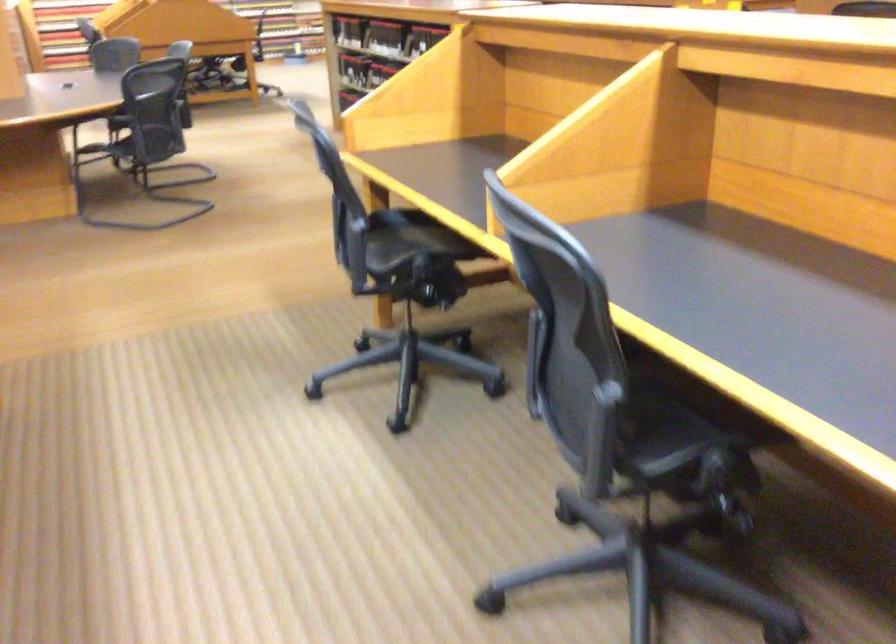
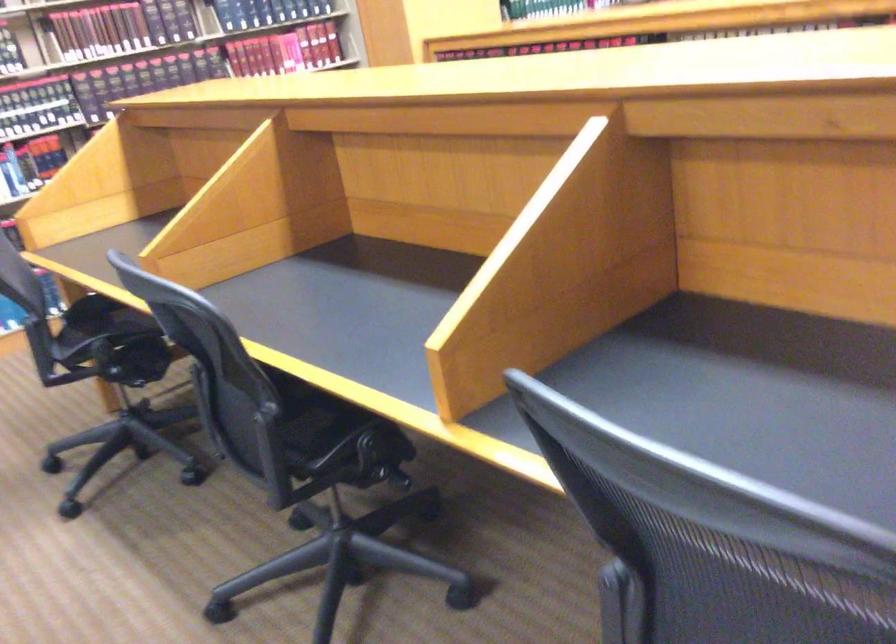
Question: I am providing you with two images of the same scene from different viewpoints. Which of the following objects are not visible in image2?

Choices:
 (A) black chair sitting surface
 (B) chair sitting surface
 (C) pink shower loofah
 (D) hardcover book

Answer: (A)